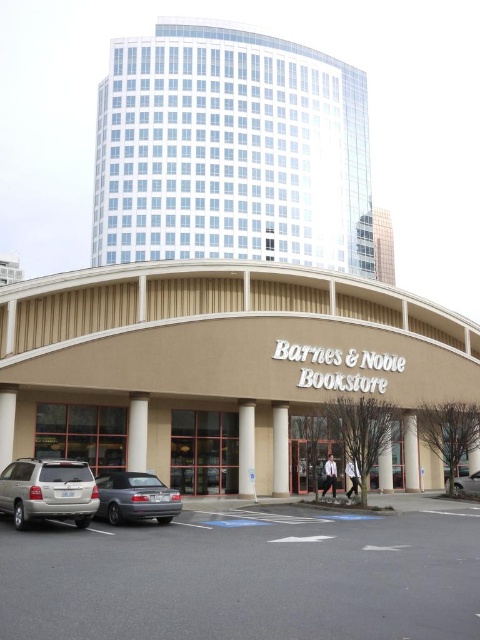
You are standing at the entrance of the Barnes and Noble Bookstore and want to find the matte gray sedan at lower left. According to the coordinates provided, where should you look relative to the bookstore?

The matte gray sedan at lower left is located at coordinates point (135, 497) relative to the bookstore, which would be to the lower left direction from the entrance.

You are a customer arriving at the Barnes and Noble bookstore and see the silver metallic suv at lower left and the matte gray sedan at lower left in the parking lot. Which car is parked more to the left side?

The silver metallic suv at lower left is parked more to the left side than the matte gray sedan at lower left.

You are a delivery person who needs to enter the Barnes and Noble Bookstore. You have a tall package that is 2 meters in height. You are standing in the parking lot and see the silver metallic suv at lower left and the matte gray sedan at lower left. Which vehicle can you park closer to the entrance without worrying about the height restriction of the bookstore entrance?

The silver metallic suv at lower left has a greater height compared to matte gray sedan at lower left. Since the package is 2 meters tall, parking closer to the entrance would be safer near the matte gray sedan at lower left, as the lower vehicle height reduces the risk of hitting the entrance with the tall package.